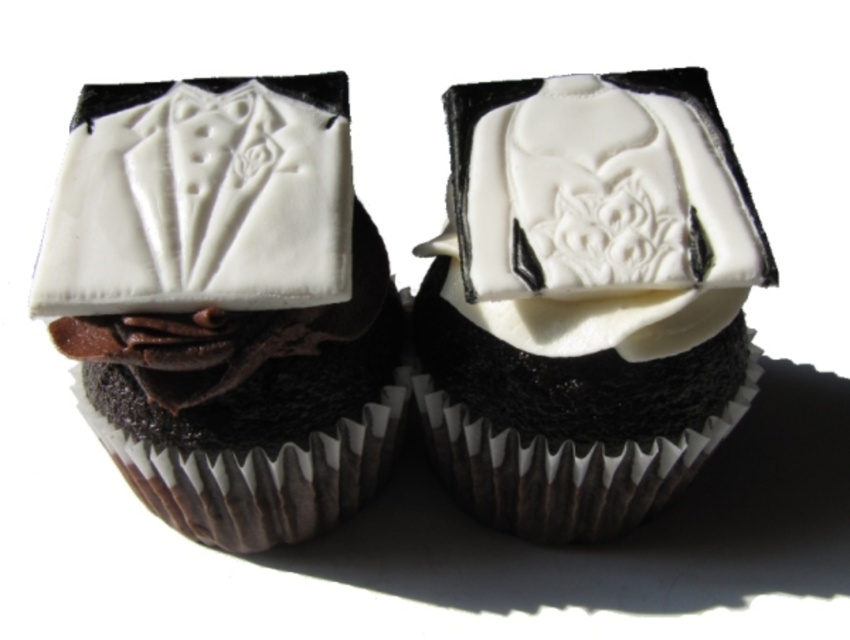
Question: Which point is closer to the camera taking this photo?

Choices:
 (A) (530, 104)
 (B) (85, 230)
 (C) (182, 497)

Answer: (B)

Question: Which is nearer to the white glossy fondant at center?

Choices:
 (A) white glossy fondant groom at center
 (B) white fondant tuxedo at center

Answer: (A)

Question: Among these objects, which one is farthest from the camera?

Choices:
 (A) white glossy fondant groom at center
 (B) white glossy fondant at center
 (C) white fondant tuxedo at center

Answer: (B)

Question: Can you confirm if white glossy fondant at center is bigger than white fondant tuxedo at center?

Choices:
 (A) no
 (B) yes

Answer: (B)

Question: Does white glossy fondant groom at center have a smaller size compared to white fondant tuxedo at center?

Choices:
 (A) yes
 (B) no

Answer: (B)

Question: Can you confirm if white glossy fondant at center is positioned below white fondant tuxedo at center?

Choices:
 (A) no
 (B) yes

Answer: (B)